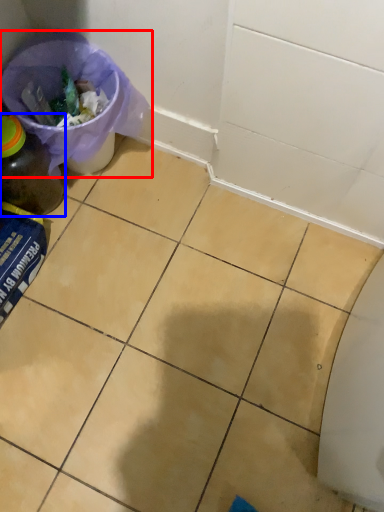
Question: Which point is closer to the camera, recycling bin (highlighted by a red box) or bottle (highlighted by a blue box)?

Choices:
 (A) recycling bin
 (B) bottle

Answer: (B)